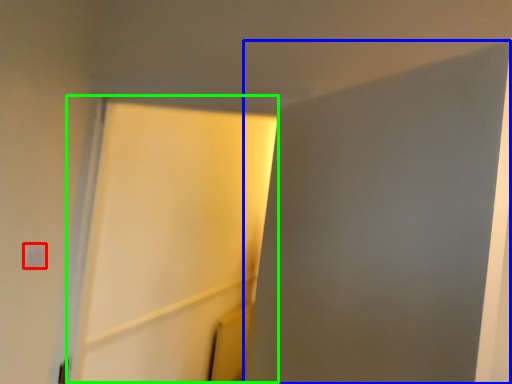
Question: Considering the real-world distances, which object is closest to light switch (highlighted by a red box)? screen door (highlighted by a blue box) or screen door (highlighted by a green box).

Choices:
 (A) screen door
 (B) screen door

Answer: (A)